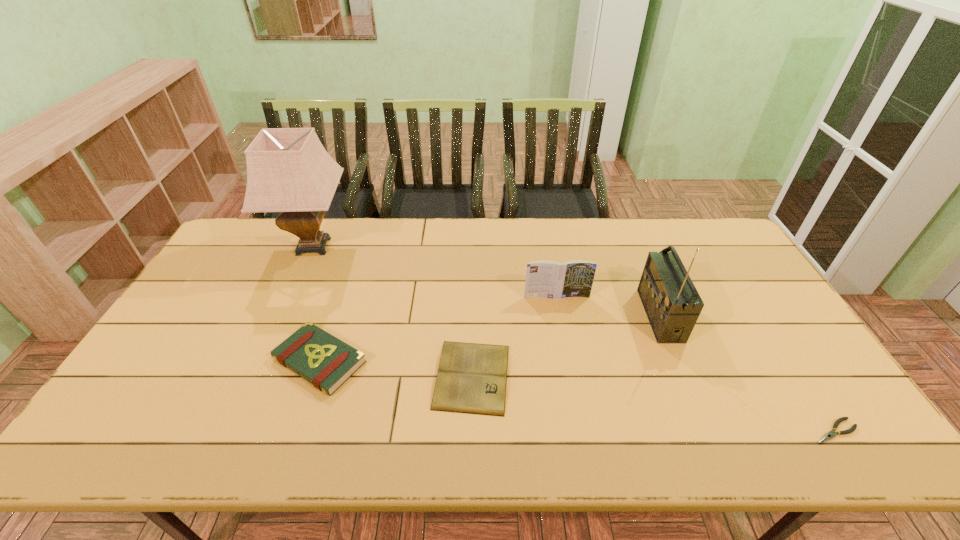
Identify which object is the fourth nearest to the lampshade. Please provide its 2D coordinates. Your answer should be formatted as a tuple, i.e. [(x, y)], where the tuple contains the x and y coordinates of a point satisfying the conditions above.

[(671, 301)]

The width and height of the screenshot is (960, 540). Identify the location of book that is the closest one to the second book from left to right. (550, 279).

Identify which book is the third closest to the tallest object. Please provide its 2D coordinates. Your answer should be formatted as a tuple, i.e. [(x, y)], where the tuple contains the x and y coordinates of a point satisfying the conditions above.

[(550, 279)]

Image resolution: width=960 pixels, height=540 pixels. What are the coordinates of `vacant area in the image that satisfies the following two spatial constraints: 1. on the front cover of the shortest object; 2. on the left side of the rightmost book` in the screenshot? It's located at (581, 431).

You are a GUI agent. You are given a task and a screenshot of the screen. Output one action in this format:
    pyautogui.click(x=<x>, y=<y>)
    Task: Click on the free region that satisfies the following two spatial constraints: 1. on the front cover of the shortest object; 2. on the left side of the third object from right to left
    The image size is (960, 540).
    Given the screenshot: What is the action you would take?
    pyautogui.click(x=581, y=431)

Locate an element on the screen. The image size is (960, 540). vacant space that satisfies the following two spatial constraints: 1. on the front side of the third object from left to right; 2. on the right side of the nearest object is located at coordinates (471, 431).